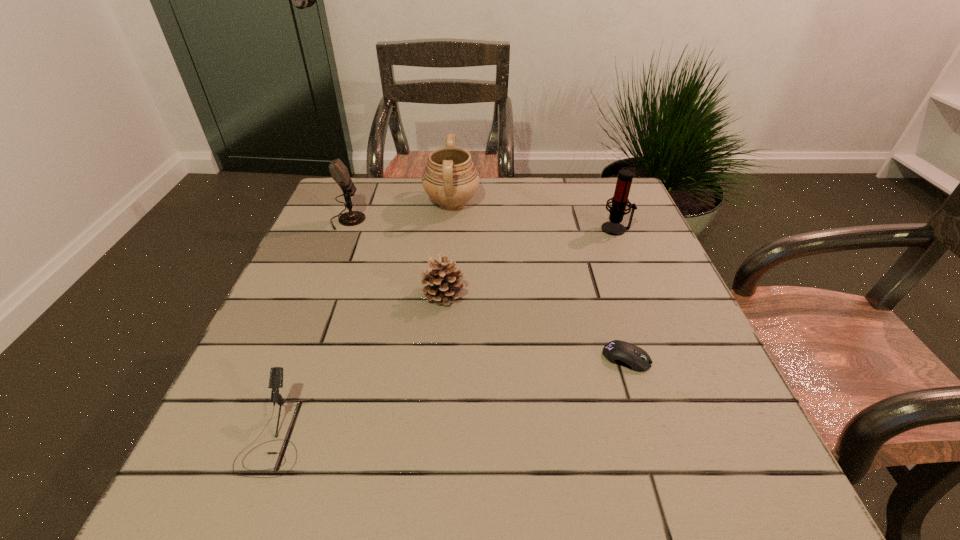
Locate an element on the screen. free space that satisfies the following two spatial constraints: 1. on the front-facing side of the fourth farthest object; 2. on the left side of the urn is located at coordinates (444, 294).

What are the coordinates of `vacant space that satisfies the following two spatial constraints: 1. on the front side of the shortest object; 2. on the left side of the pinecone` in the screenshot? It's located at (439, 358).